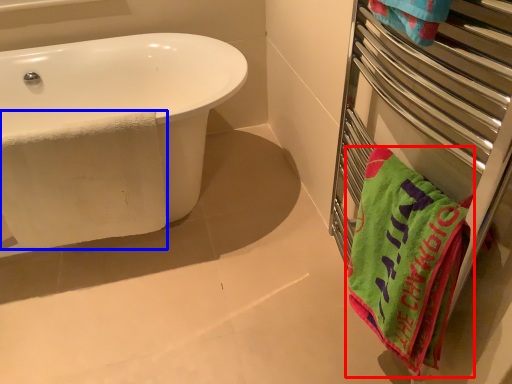
Question: Which object is closer to the camera taking this photo, towel (highlighted by a red box) or beach towel (highlighted by a blue box)?

Choices:
 (A) towel
 (B) beach towel

Answer: (A)